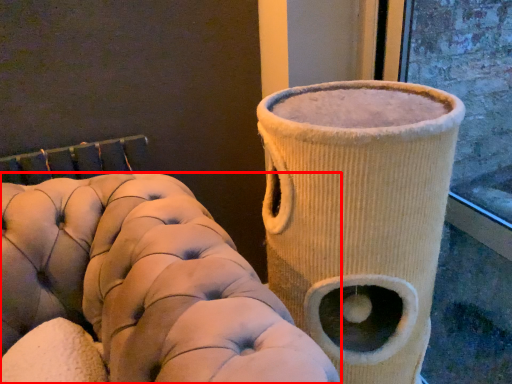
Question: From the image's perspective, what is the correct spatial positioning of furniture (annotated by the red box) in reference to vase?

Choices:
 (A) above
 (B) below

Answer: (B)